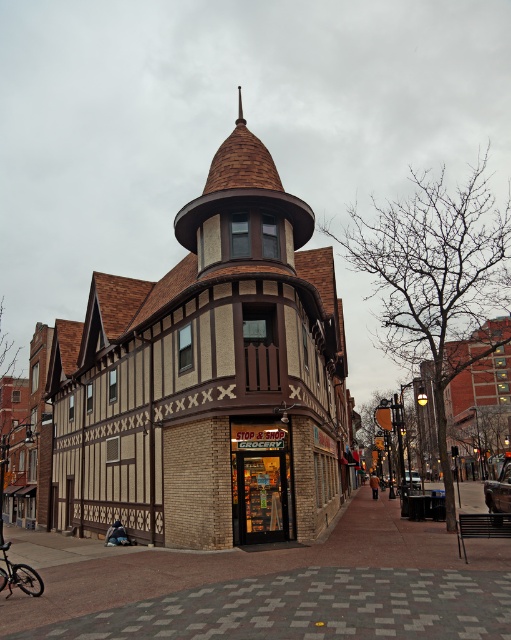
Question: Observing the image, what is the correct spatial positioning of matte glass storefront at center in reference to black matte bicycle at lower left?

Choices:
 (A) right
 (B) left

Answer: (A)

Question: Is matte glass storefront at center further to the viewer compared to black matte bicycle at lower left?

Choices:
 (A) yes
 (B) no

Answer: (A)

Question: Which is farther from the brown wood/brick tower at center?

Choices:
 (A) black matte bicycle at lower left
 (B) matte glass storefront at center

Answer: (A)

Question: Considering the real-world distances, which object is closest to the brown wood/brick tower at center?

Choices:
 (A) matte glass storefront at center
 (B) black matte bicycle at lower left

Answer: (A)

Question: Which object is positioned closest to the matte glass storefront at center?

Choices:
 (A) black matte bicycle at lower left
 (B) brown wood/brick tower at center

Answer: (A)

Question: Is brown wood/brick tower at center bigger than black matte bicycle at lower left?

Choices:
 (A) yes
 (B) no

Answer: (A)